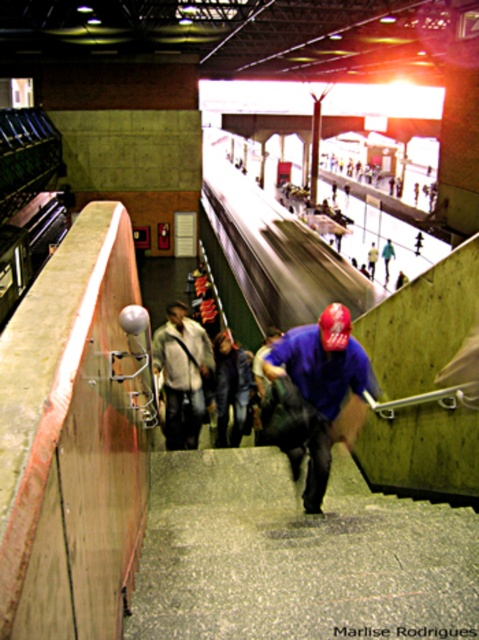
Question: Is blue matte shirt at center smaller than dark blue shirt at center?

Choices:
 (A) yes
 (B) no

Answer: (B)

Question: Estimate the real-world distances between objects in this image. Which object is closer to the blue matte shirt at center?

Choices:
 (A) light brown leather jacket at center
 (B) dark blue shirt at center

Answer: (B)

Question: Which object is farther from the camera taking this photo?

Choices:
 (A) light brown leather jacket at center
 (B) blue matte shirt at center

Answer: (A)

Question: Among these points, which one is farthest from the camera?

Choices:
 (A) (306, 480)
 (B) (182, 307)
 (C) (238, 397)

Answer: (C)

Question: Does blue matte shirt at center appear over light brown leather jacket at center?

Choices:
 (A) no
 (B) yes

Answer: (A)

Question: Is light brown leather jacket at center closer to camera compared to dark blue shirt at center?

Choices:
 (A) yes
 (B) no

Answer: (A)